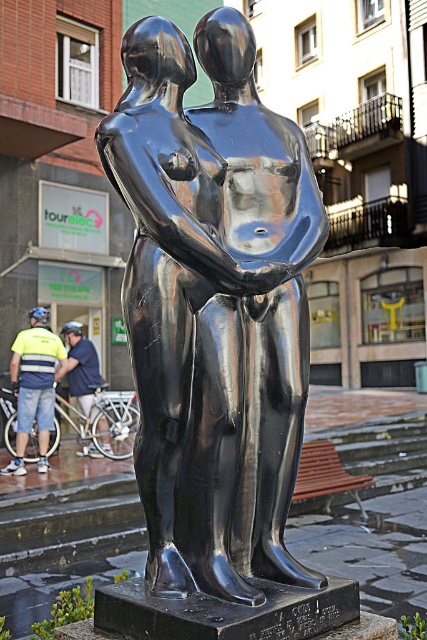
Question: Based on their relative distances, which object is farther from the yellow-green shirt at left?

Choices:
 (A) polished black statue at center
 (B) matte blue helmet at left

Answer: (A)

Question: Does polished black statue at center have a greater width compared to matte blue helmet at left?

Choices:
 (A) no
 (B) yes

Answer: (B)

Question: Is polished black statue at center bigger than yellow-green shirt at left?

Choices:
 (A) yes
 (B) no

Answer: (B)

Question: Which of the following is the farthest from the observer?

Choices:
 (A) (234, 586)
 (B) (85, 353)

Answer: (B)

Question: Among these objects, which one is farthest from the camera?

Choices:
 (A) matte blue helmet at left
 (B) yellow-green shirt at left

Answer: (A)

Question: Can you confirm if polished black statue at center is smaller than matte blue helmet at left?

Choices:
 (A) no
 (B) yes

Answer: (B)